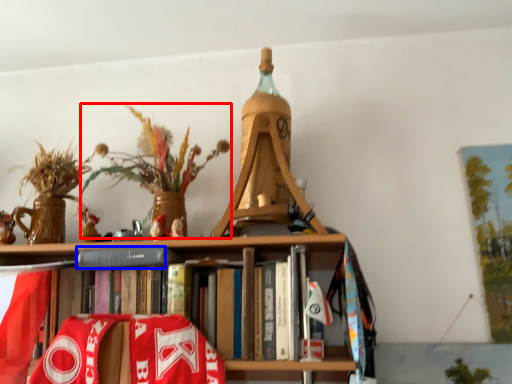
Question: Which of the following is the farthest to the observer, floral arrangement (highlighted by a red box) or paperback book (highlighted by a blue box)?

Choices:
 (A) floral arrangement
 (B) paperback book

Answer: (B)